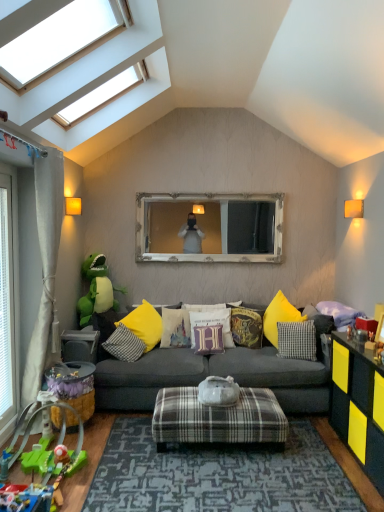
You are a GUI agent. You are given a task and a screenshot of the screen. Output one action in this format:
    pyautogui.click(x=<x>, y=<y>)
    Task: Click on the empty space that is ontop of wooden framed mirror at center
    The width and height of the screenshot is (384, 512).
    Given the screenshot: What is the action you would take?
    pyautogui.click(x=219, y=187)